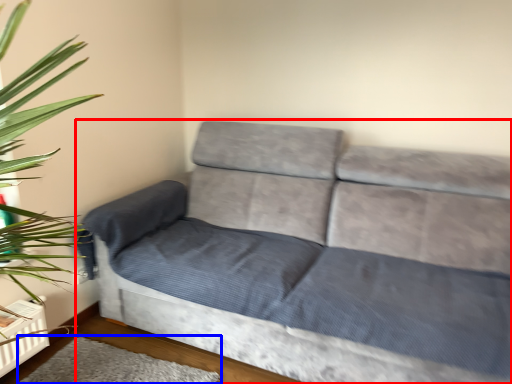
Question: Which object appears closest to the camera in this image, studio couch (highlighted by a red box) or mat (highlighted by a blue box)?

Choices:
 (A) studio couch
 (B) mat

Answer: (A)